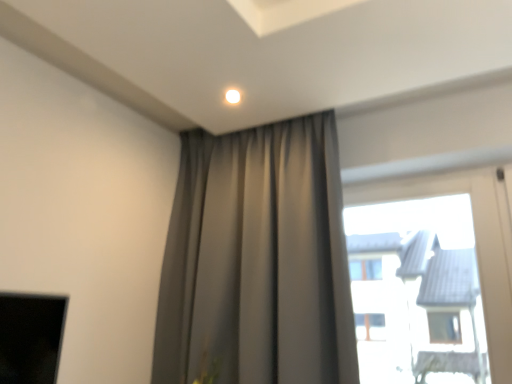
Question: In terms of size, does satin gray curtain at upper center appear bigger or smaller than transparent glass window at upper right?

Choices:
 (A) small
 (B) big

Answer: (B)

Question: Is satin gray curtain at upper center wider or thinner than transparent glass window at upper right?

Choices:
 (A) thin
 (B) wide

Answer: (B)

Question: Based on their positions, is satin gray curtain at upper center located to the left or right of transparent glass window at upper right?

Choices:
 (A) right
 (B) left

Answer: (B)

Question: From a real-world perspective, is transparent glass window at upper right above or below satin gray curtain at upper center?

Choices:
 (A) above
 (B) below

Answer: (B)

Question: In terms of size, does transparent glass window at upper right appear bigger or smaller than satin gray curtain at upper center?

Choices:
 (A) big
 (B) small

Answer: (B)

Question: Is point (503, 241) closer or farther from the camera than point (187, 228)?

Choices:
 (A) closer
 (B) farther

Answer: (A)

Question: Is transparent glass window at upper right taller or shorter than satin gray curtain at upper center?

Choices:
 (A) tall
 (B) short

Answer: (B)